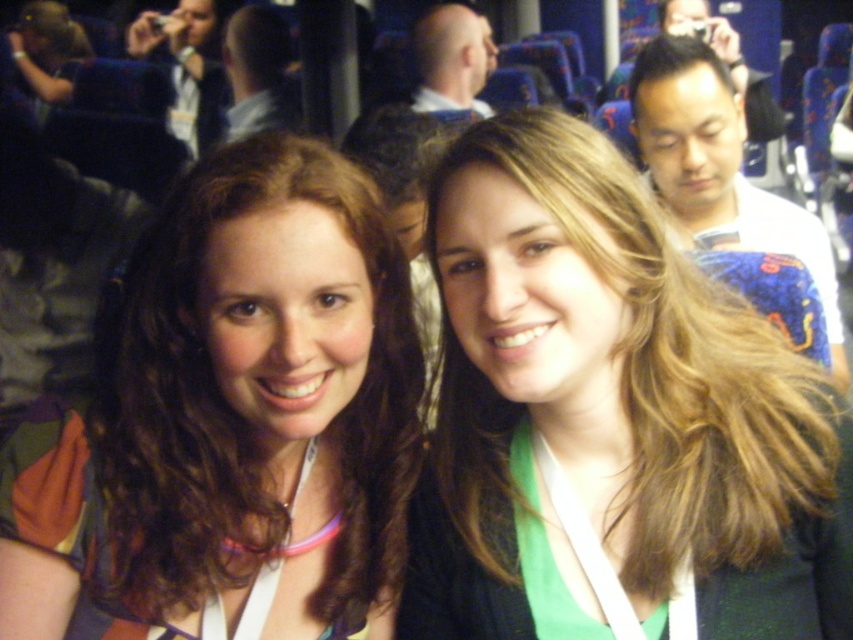
Question: Which object appears closest to the camera in this image?

Choices:
 (A) smooth gray shirt at upper center
 (B) blonde hair at center

Answer: (B)

Question: Is blonde hair at center in front of smooth bald head at center?

Choices:
 (A) yes
 (B) no

Answer: (A)

Question: Which object is farther from the camera taking this photo?

Choices:
 (A) smooth gray shirt at upper center
 (B) matte black camera at upper left

Answer: (B)

Question: Observing the image, what is the correct spatial positioning of multicolored fabric at center in reference to smooth bald head at center?

Choices:
 (A) below
 (B) above

Answer: (A)

Question: Which of the following is the closest to the observer?

Choices:
 (A) (x=236, y=124)
 (B) (x=308, y=467)
 (C) (x=670, y=164)

Answer: (B)

Question: Is white cotton shirt at upper right bigger than smooth gray shirt at upper center?

Choices:
 (A) no
 (B) yes

Answer: (A)